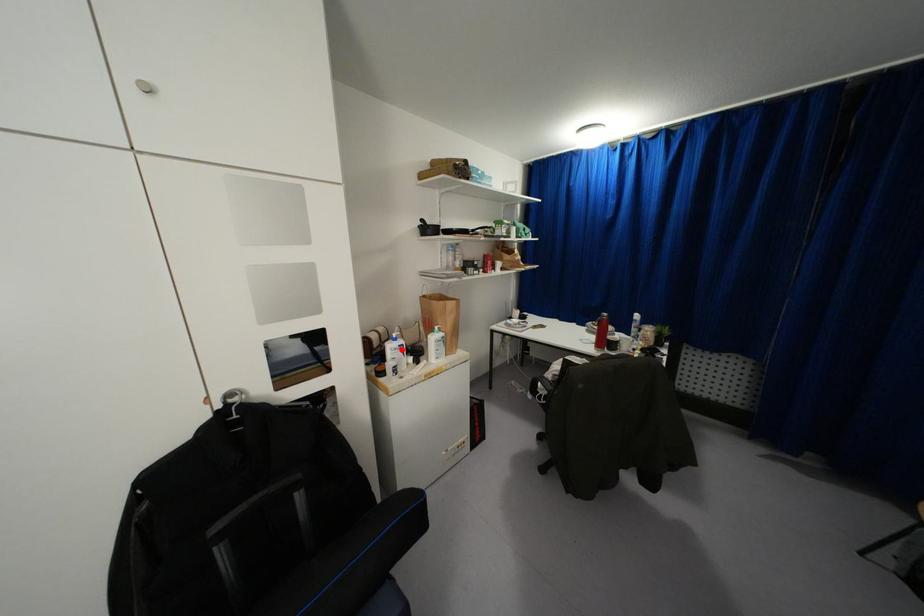
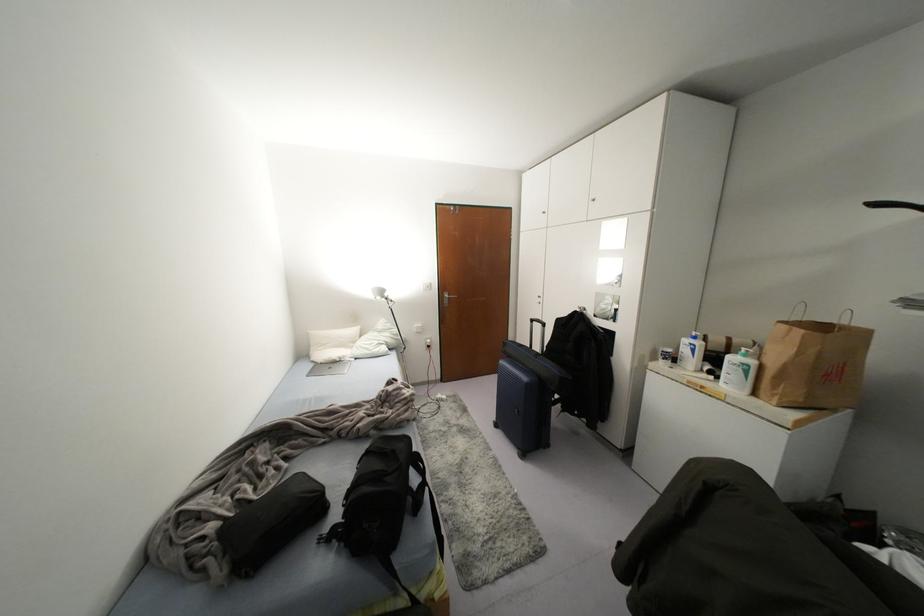
Locate, in the second image, the point that corresponds to the highlighted location in the first image.

(691, 350)